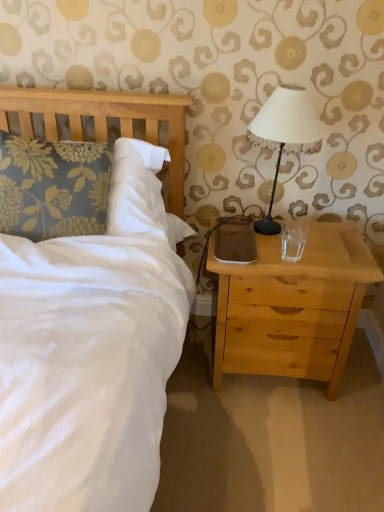
Question: Could light wood nightstand at right be considered to be inside floral fabric pillow at left?

Choices:
 (A) yes
 (B) no

Answer: (B)

Question: Does floral fabric pillow at left have a larger size compared to light wood nightstand at right?

Choices:
 (A) no
 (B) yes

Answer: (A)

Question: From a real-world perspective, is floral fabric pillow at left positioned over light wood nightstand at right based on gravity?

Choices:
 (A) no
 (B) yes

Answer: (B)

Question: Does floral fabric pillow at left have a smaller size compared to light wood nightstand at right?

Choices:
 (A) no
 (B) yes

Answer: (B)

Question: Is floral fabric pillow at left with light wood nightstand at right?

Choices:
 (A) no
 (B) yes

Answer: (A)

Question: Is white fabric-covered lampshade at upper right taller or shorter than transparent glass at right?

Choices:
 (A) tall
 (B) short

Answer: (A)

Question: In the image, is white fabric-covered lampshade at upper right positioned in front of or behind transparent glass at right?

Choices:
 (A) front
 (B) behind

Answer: (A)

Question: From the image's perspective, relative to transparent glass at right, is white fabric-covered lampshade at upper right above or below?

Choices:
 (A) below
 (B) above

Answer: (B)

Question: Choose the correct answer: Is white fabric-covered lampshade at upper right inside transparent glass at right or outside it?

Choices:
 (A) outside
 (B) inside

Answer: (A)

Question: Considering the positions of light wood nightstand at right and floral fabric pillow at left in the image, is light wood nightstand at right bigger or smaller than floral fabric pillow at left?

Choices:
 (A) big
 (B) small

Answer: (A)

Question: Looking at their shapes, would you say light wood nightstand at right is wider or thinner than floral fabric pillow at left?

Choices:
 (A) wide
 (B) thin

Answer: (A)

Question: From the image's perspective, is light wood nightstand at right positioned above or below floral fabric pillow at left?

Choices:
 (A) above
 (B) below

Answer: (B)

Question: Based on their positions, is light wood nightstand at right located to the left or right of floral fabric pillow at left?

Choices:
 (A) left
 (B) right

Answer: (B)

Question: From the image's perspective, is light wood nightstand at right above or below white fabric-covered lampshade at upper right?

Choices:
 (A) above
 (B) below

Answer: (B)

Question: Is light wood nightstand at right spatially inside white fabric-covered lampshade at upper right, or outside of it?

Choices:
 (A) inside
 (B) outside

Answer: (B)